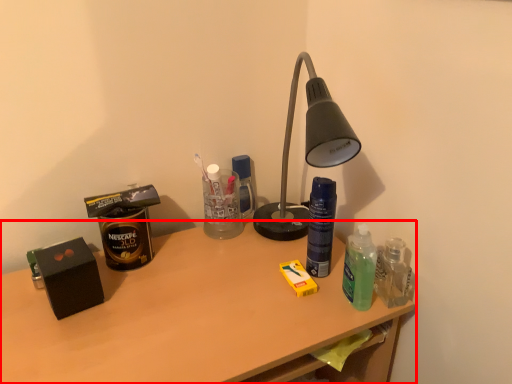
Question: From the image's perspective, where is desk (annotated by the red box) located relative to bottle?

Choices:
 (A) above
 (B) below

Answer: (B)